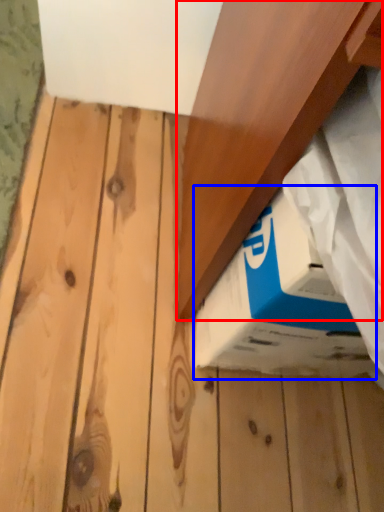
Question: Which object is further to the camera taking this photo, plank (highlighted by a red box) or box (highlighted by a blue box)?

Choices:
 (A) plank
 (B) box

Answer: (B)